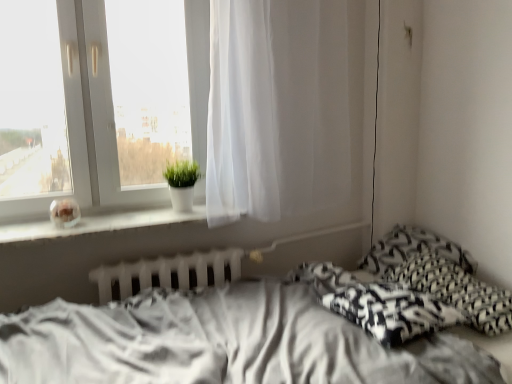
Question: Relative to green matte plant at window, is white matte window sill at left in front or behind?

Choices:
 (A) front
 (B) behind

Answer: (A)

Question: From the image's perspective, is white matte window sill at left located above or below green matte plant at window?

Choices:
 (A) below
 (B) above

Answer: (A)

Question: Estimate the real-world distances between objects in this image. Which object is closer to the white glossy vase at upper left?

Choices:
 (A) white sheer curtain at center
 (B) white fabric bed at lower right
 (C) green matte plant at window
 (D) black and white woven blanket at lower right
 (E) black and white patterned pillow at lower right, which ranks as the 2th pillow in back-to-front order

Answer: (C)

Question: Based on their relative distances, which object is farther from the black and white woven blanket at lower right?

Choices:
 (A) white plastic radiator at lower center
 (B) black printed pillow at right, the first pillow in the back-to-front sequence
 (C) green matte plant at window
 (D) white fabric bed at lower right
 (E) black and white patterned pillow at lower right, the 1th pillow when ordered from front to back

Answer: (C)